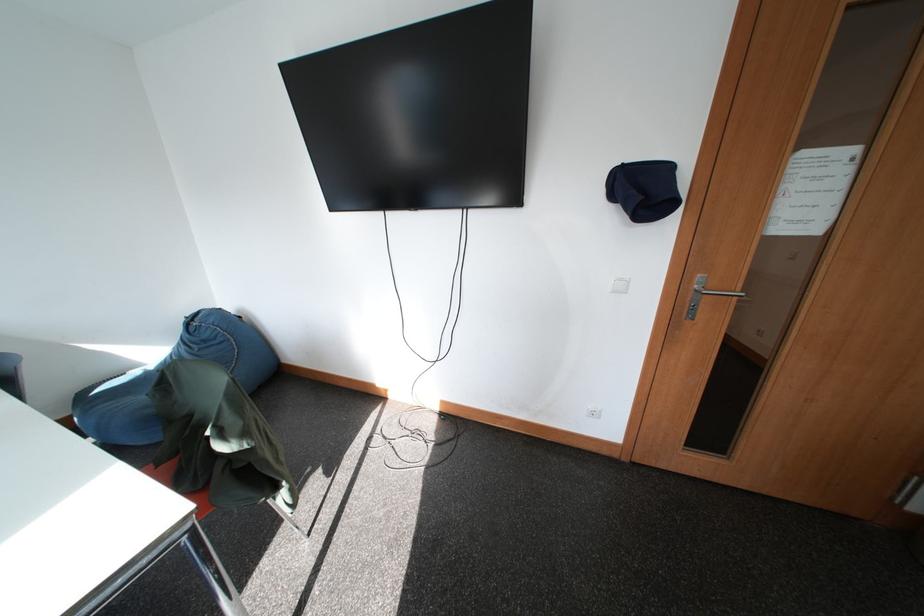
The width and height of the screenshot is (924, 616). What do you see at coordinates (124, 408) in the screenshot?
I see `the blue beanbag surface` at bounding box center [124, 408].